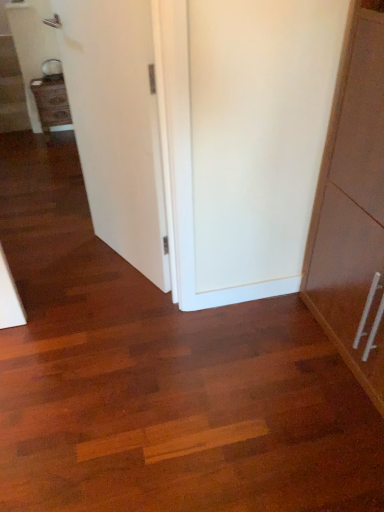
Question: Does point (0, 89) appear closer or farther from the camera than point (41, 106)?

Choices:
 (A) closer
 (B) farther

Answer: (B)

Question: Is wooden staircase at left situated inside matte wood cabinet at left or outside?

Choices:
 (A) outside
 (B) inside

Answer: (A)

Question: Which object is positioned farthest from the matte wood cabinet at left?

Choices:
 (A) white smooth door at center
 (B) wooden staircase at left

Answer: (A)

Question: Which is farther from the matte wood cabinet at left?

Choices:
 (A) wooden staircase at left
 (B) white smooth door at center

Answer: (B)